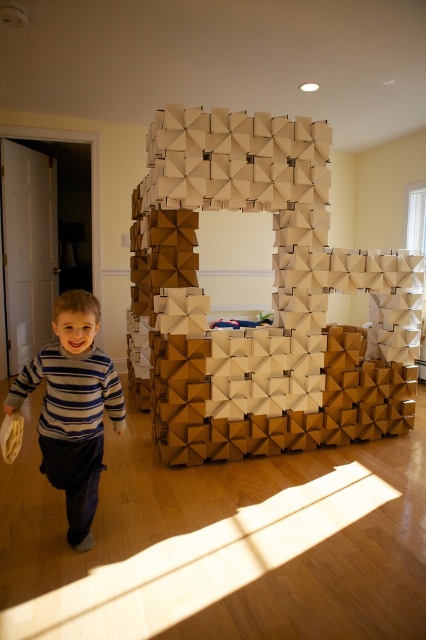
You are a photographer setting up a shot of the white cardboard structure at center and the striped sweater at center. You need to ensure both are fully visible in the frame. Which object requires a wider angle to capture its full width?

The white cardboard structure at center requires a wider angle because its width surpasses that of the striped sweater at center, meaning it occupies more space horizontally and thus needs a larger frame to be fully captured.

Looking at this image, you are a photographer setting up a shoot in this room. You want to ensure that the white cardboard structure at center and the striped sweater at center are both visible in the frame. Based on their positions, which object should you focus on first to ensure both are in focus?

The white cardboard structure at center is positioned over striped sweater at center, so focusing on the white cardboard structure at center first will ensure both objects are in focus as they are layered.